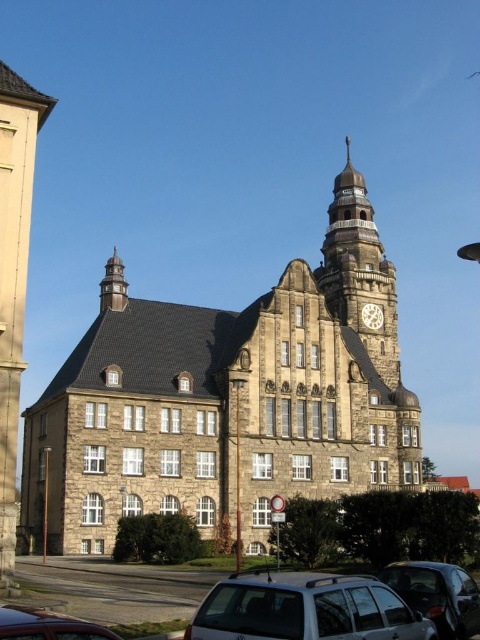
Question: Which object appears farthest from the camera in this image?

Choices:
 (A) stone tower at left
 (B) metallic silver car at lower left
 (C) silver metallic car at lower center

Answer: (A)

Question: Considering the relative positions of stone clock tower at upper center and metallic silver car at lower left in the image provided, where is stone clock tower at upper center located with respect to metallic silver car at lower left?

Choices:
 (A) above
 (B) below

Answer: (A)

Question: Among these objects, which one is nearest to the camera?

Choices:
 (A) stone clock tower at upper center
 (B) stone tower at left
 (C) silver metallic car at lower center

Answer: (C)

Question: Does stone tower at left lie in front of metallic silver car at lower left?

Choices:
 (A) yes
 (B) no

Answer: (B)

Question: Estimate the real-world distances between objects in this image. Which object is closer to the stone tower at left?

Choices:
 (A) stone clock tower at upper center
 (B) brown stone clock tower at upper center
 (C) metallic silver car at lower left

Answer: (C)

Question: Does metallic silver car at lower left have a larger size compared to gold metallic clock at upper center?

Choices:
 (A) yes
 (B) no

Answer: (A)